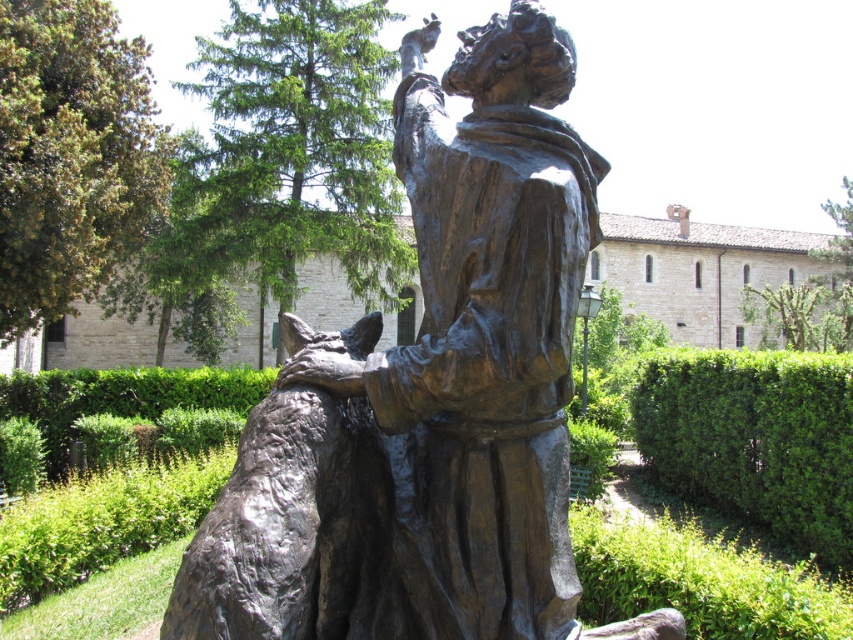
Question: Which point is closer to the camera taking this photo?

Choices:
 (A) (529, 516)
 (B) (815, 387)

Answer: (A)

Question: Can you confirm if bronze statue at center is smaller than green leafy hedge at right?

Choices:
 (A) yes
 (B) no

Answer: (A)

Question: Does bronze statue at center appear under green leafy hedge at right?

Choices:
 (A) no
 (B) yes

Answer: (A)

Question: Can you confirm if bronze statue at center is positioned above green leafy hedge at right?

Choices:
 (A) no
 (B) yes

Answer: (B)